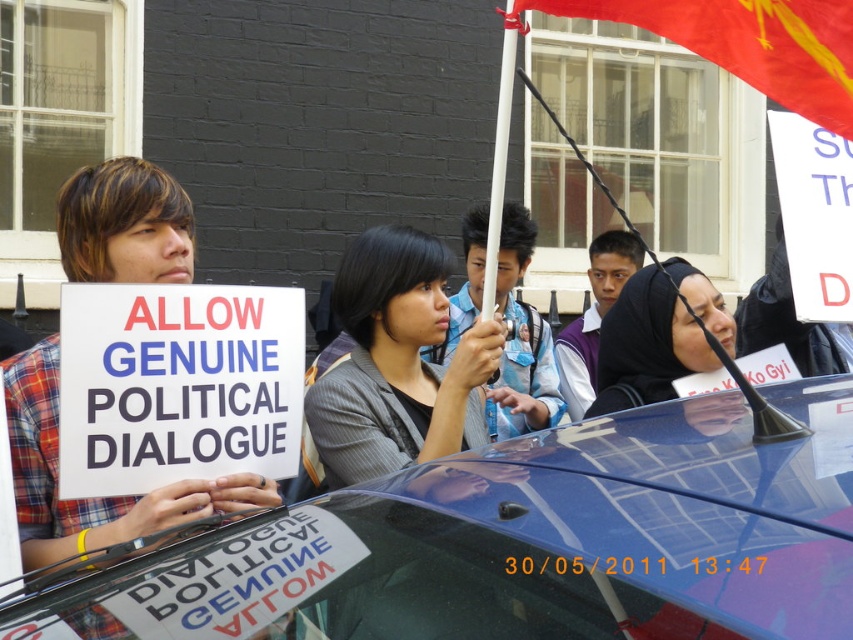
You are a photographer standing at the camera position. You want to take a closeup shot of the gray textured blazer at center without moving the camera. Is it possible to do so with a standard zoom lens that has a maximum zoom of 2 meters?

The gray textured blazer at center is 2.64 meters away from the camera. Since the standard zoom lens can only zoom up to 2 meters, it cannot capture a closeup of the blazer at that distance without moving the camera.

You are a photographer trying to capture a clear photo of both the gray textured blazer at center and the matte black hijab at center. Based on their positions and sizes, do you think you can fit both into the frame without zooming in?

The gray textured blazer at center might be wider than matte black hijab at center, so it is possible to fit both into the frame without zooming in, as the blazer is likely wider and could occupy more space while still allowing the hijab to be visible.

You are a photographer trying to capture a clear photo of the gray textured blazer at center and the red fabric flag at upper right. Which object will appear closer to the camera in the photo?

The gray textured blazer at center will appear closer to the camera because the red fabric flag at upper right is behind it.